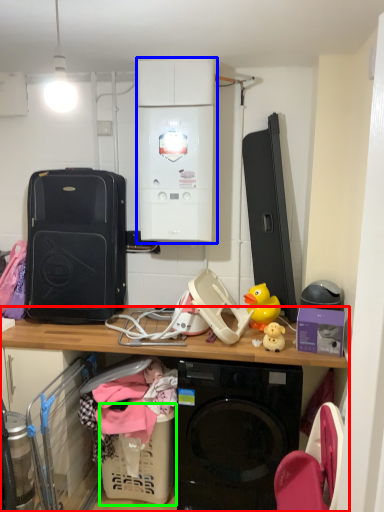
Question: Which object is positioned closest to desk (highlighted by a red box)? Select from appliance (highlighted by a blue box) and basket (highlighted by a green box).

Choices:
 (A) appliance
 (B) basket

Answer: (B)